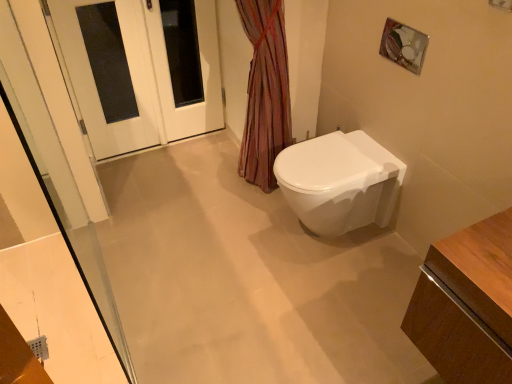
This screenshot has height=384, width=512. I want to click on vacant space underneath white glossy toilet at center-right (from a real-world perspective), so click(x=313, y=237).